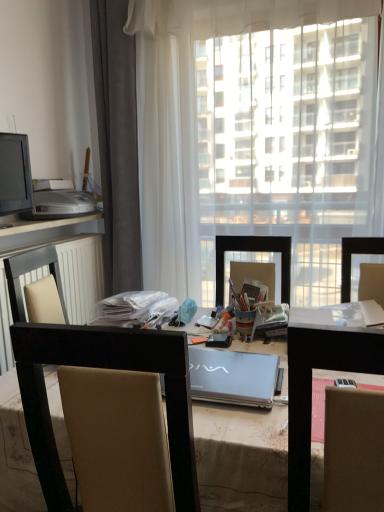
Question: In terms of height, does metallic silver laptop at center look taller or shorter compared to transparent fabric at center?

Choices:
 (A) tall
 (B) short

Answer: (B)

Question: Is metallic silver laptop at center bigger or smaller than transparent fabric at center?

Choices:
 (A) big
 (B) small

Answer: (B)

Question: Which is nearer to the black plastic computer desk at lower left?

Choices:
 (A) metallic silver laptop at center
 (B) gray fabric curtain at left
 (C) transparent fabric at center
 (D) matte black monitor at left
 (E) beige fabric chair at center

Answer: (D)

Question: Which of these objects is positioned closest to the beige fabric chair at center?

Choices:
 (A) matte black monitor at left
 (B) transparent fabric at center
 (C) metallic silver laptop at center
 (D) black plastic computer desk at lower left
 (E) gray fabric curtain at left

Answer: (C)